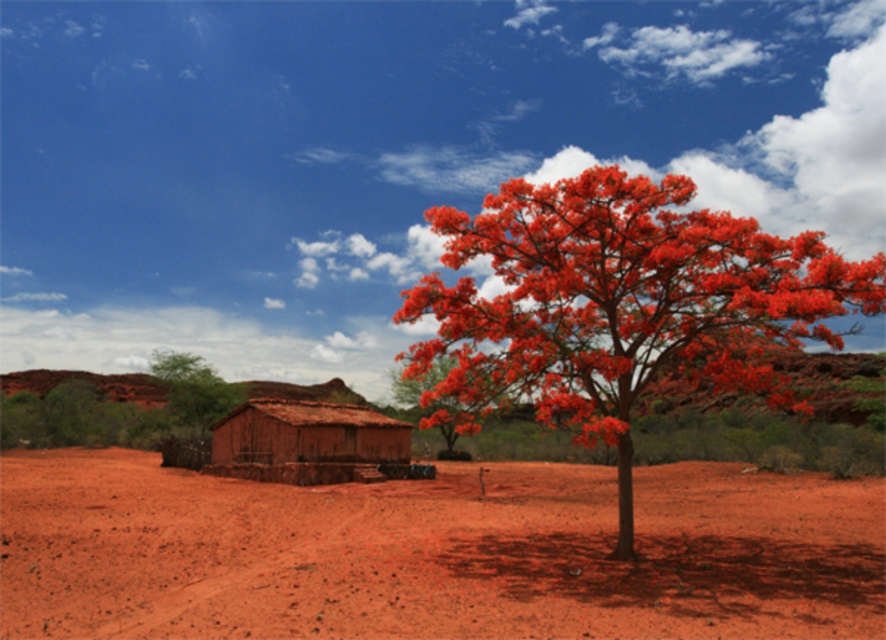
Question: Can you confirm if dusty red dirt field at center is bigger than brown clay hut at center?

Choices:
 (A) yes
 (B) no

Answer: (A)

Question: Among these objects, which one is farthest from the camera?

Choices:
 (A) bright red petal at upper right
 (B) brown clay hut at center

Answer: (B)

Question: Estimate the real-world distances between objects in this image. Which object is closer to the dusty red dirt field at center?

Choices:
 (A) brown clay hut at center
 (B) bright red petal at upper right

Answer: (B)

Question: Which point is closer to the camera taking this photo?

Choices:
 (A) (235, 467)
 (B) (554, 483)
 (C) (814, 260)

Answer: (C)

Question: Is dusty red dirt field at center below bright red petal at upper right?

Choices:
 (A) no
 (B) yes

Answer: (B)

Question: Can you confirm if dusty red dirt field at center is thinner than bright red petal at upper right?

Choices:
 (A) no
 (B) yes

Answer: (A)